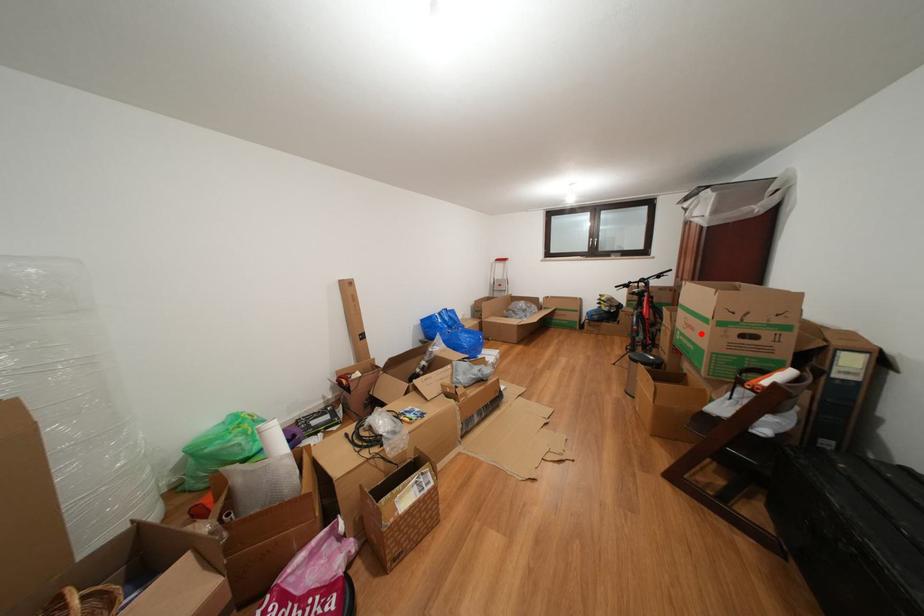
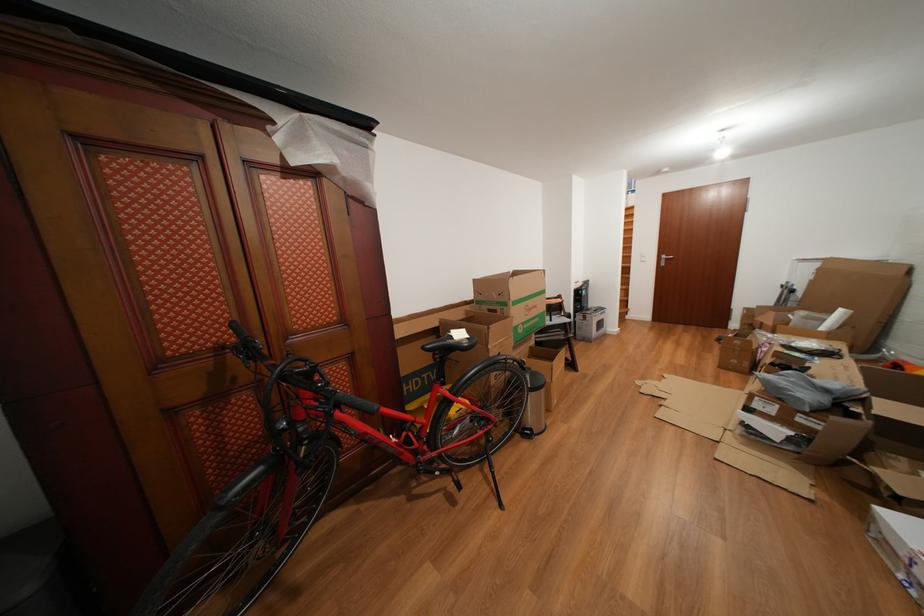
Find the pixel in the second image that matches the highlighted location in the first image.

(543, 312)